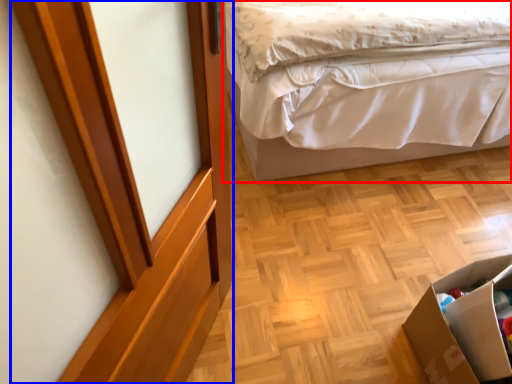
Question: Among these objects, which one is nearest to the camera, bed (highlighted by a red box) or screen door (highlighted by a blue box)?

Choices:
 (A) bed
 (B) screen door

Answer: (B)